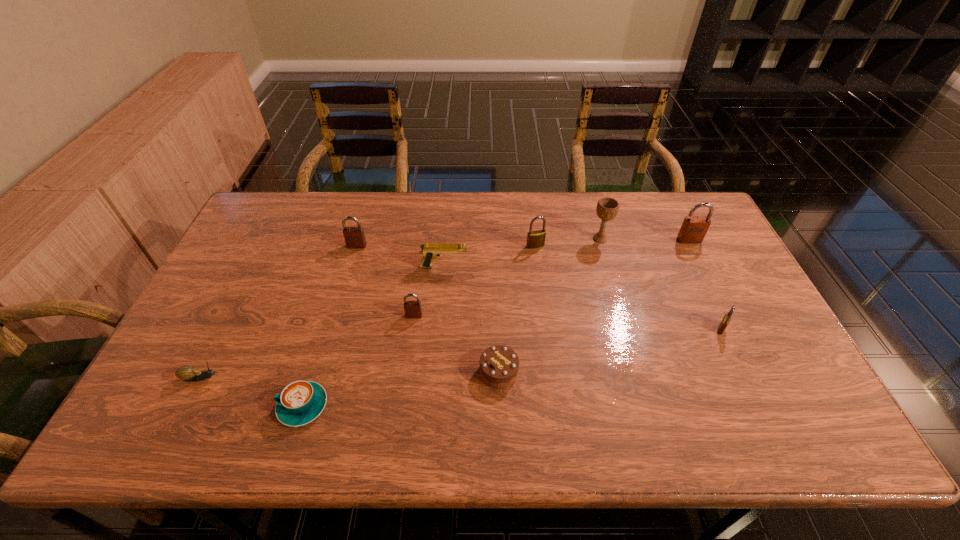
The height and width of the screenshot is (540, 960). What are the coordinates of `object at the far edge` in the screenshot? It's located at (607, 208).

Identify the location of object present at the near edge. This screenshot has width=960, height=540. (300, 402).

At what (x,y) coordinates should I click in order to perform the action: click on object that is positioned at the left edge. Please return your answer as a coordinate pair (x, y). This screenshot has height=540, width=960. Looking at the image, I should click on (189, 373).

Identify the location of free space at the far edge of the desktop. (523, 234).

The image size is (960, 540). Identify the location of vacant space at the near edge. (734, 435).

Identify the location of vacant region at the left edge of the desktop. The height and width of the screenshot is (540, 960). (218, 306).

In the image, there is a desktop. Where is `vacant space at the far left corner`? This screenshot has height=540, width=960. vacant space at the far left corner is located at coordinates (245, 228).

The width and height of the screenshot is (960, 540). In order to click on unoccupied area between the chalice and the rightmost brown padlock in this screenshot , I will do pyautogui.click(x=644, y=239).

Find the location of a particular element. The image size is (960, 540). unoccupied area between the tallest padlock and the escargot is located at coordinates (445, 309).

Locate an element on the screen. Image resolution: width=960 pixels, height=540 pixels. free space between the eighth tallest object and the right brass padlock is located at coordinates (611, 350).